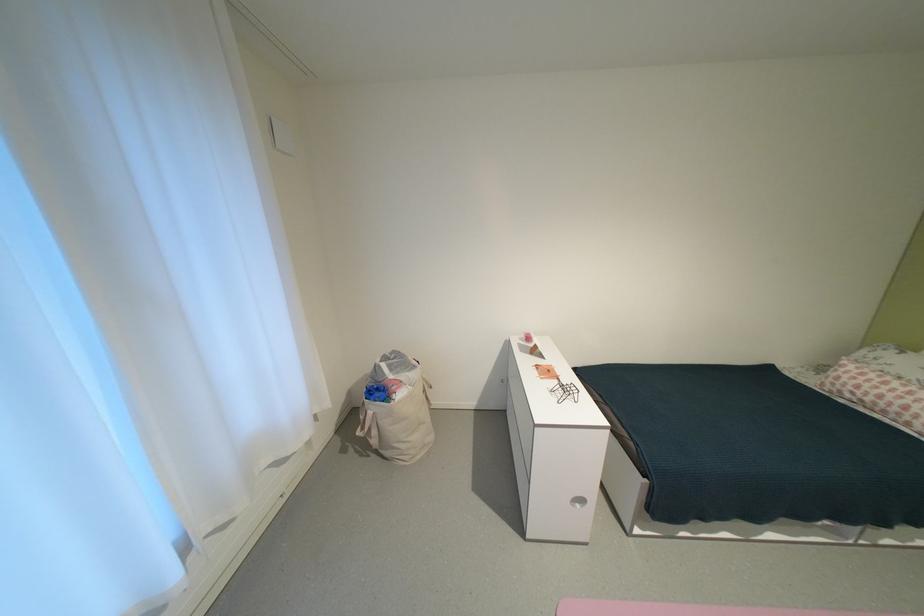
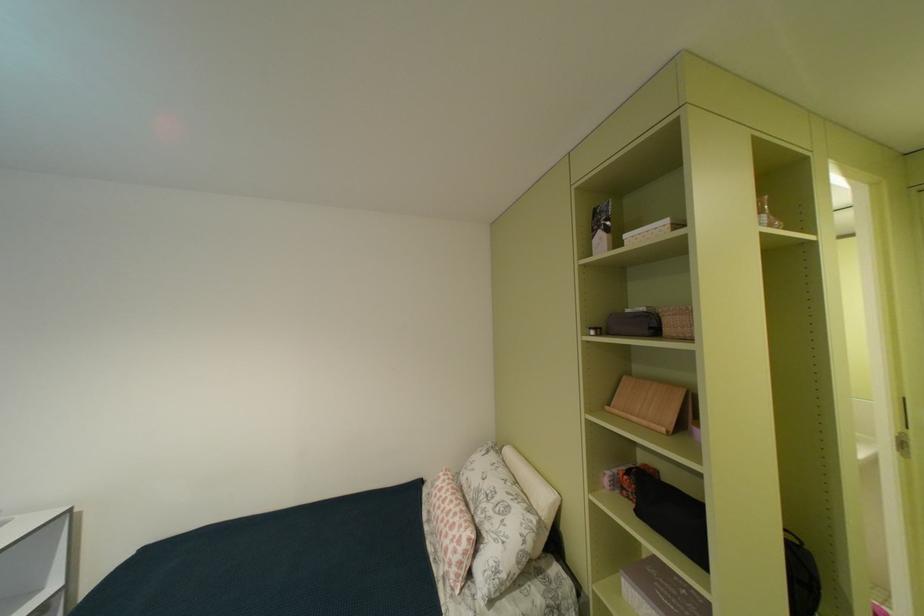
Question: Which direction would the cameraman need to move to produce the second image? Reply with the corresponding letter.

Choices:
 (A) Left
 (B) Right
 (C) Forward
 (D) Backward

Answer: (B)